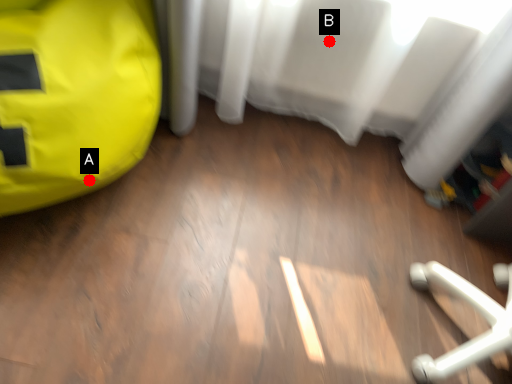
Question: Two points are circled on the image, labeled by A and B beside each circle. Among these points, which one is nearest to the camera?

Choices:
 (A) A is closer
 (B) B is closer

Answer: (A)